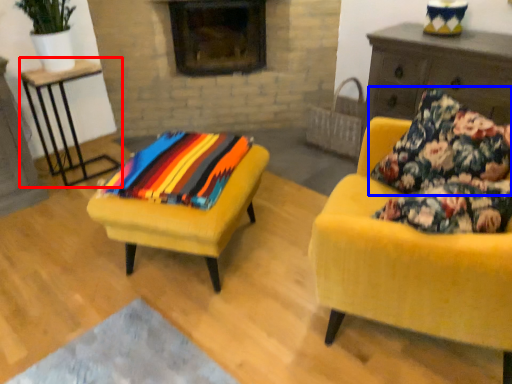
Question: Among these objects, which one is farthest to the camera, table (highlighted by a red box) or pillow (highlighted by a blue box)?

Choices:
 (A) table
 (B) pillow

Answer: (A)